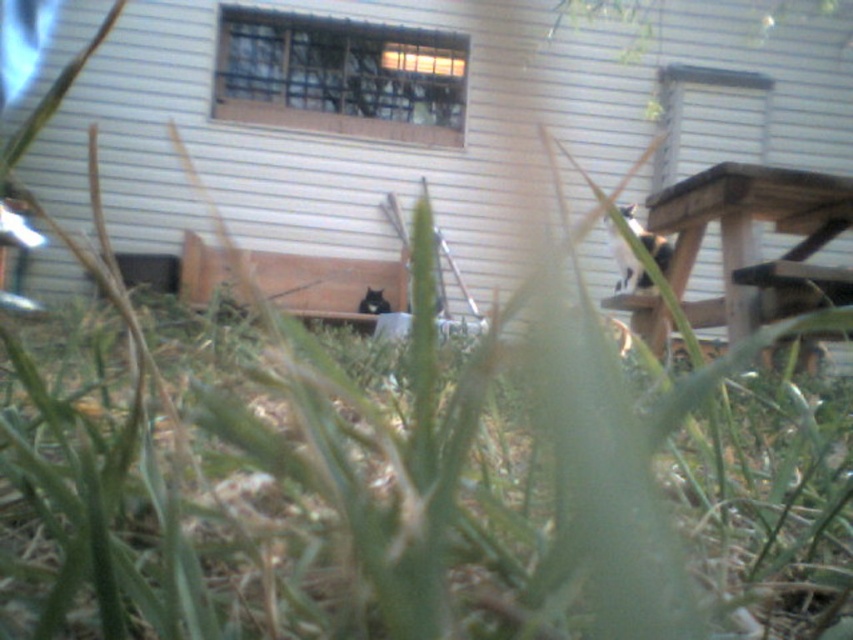
Question: Can you confirm if white fur cat at upper right is positioned to the left of black fur cat at center?

Choices:
 (A) yes
 (B) no

Answer: (B)

Question: Does white fur cat at upper right lie behind black fur cat at center?

Choices:
 (A) yes
 (B) no

Answer: (B)

Question: Is white fur cat at upper right above black fur cat at center?

Choices:
 (A) yes
 (B) no

Answer: (A)

Question: Which object appears farthest from the camera in this image?

Choices:
 (A) white fur cat at upper right
 (B) black fur cat at center

Answer: (B)